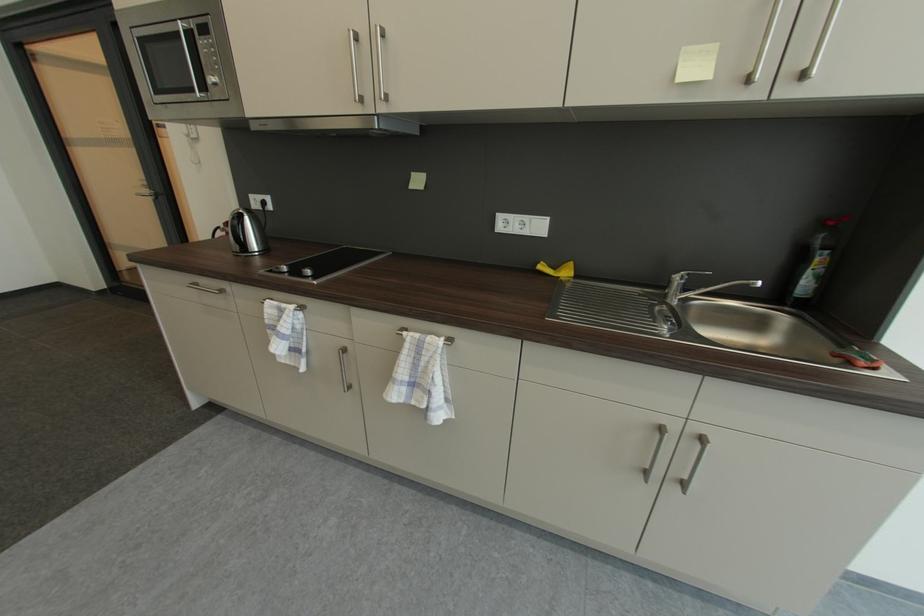
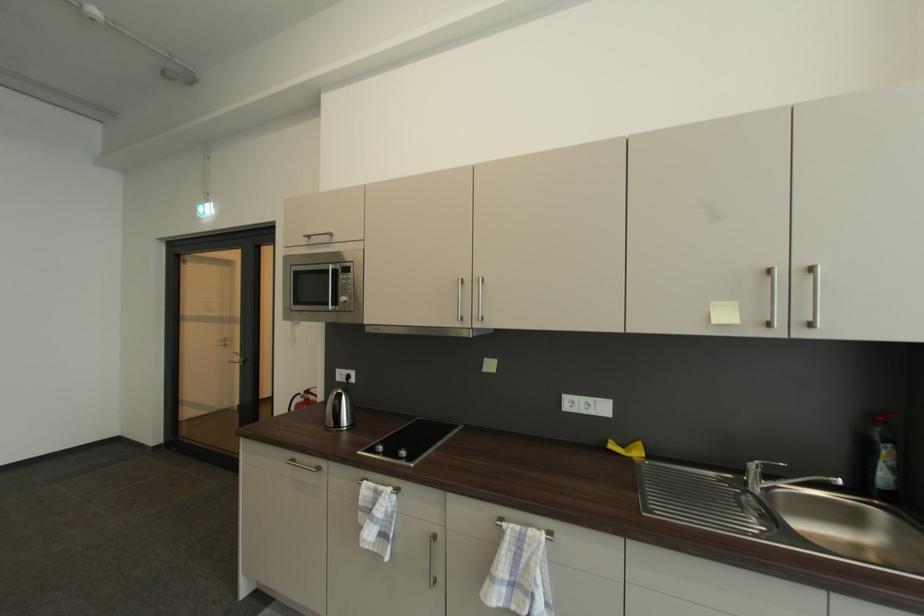
Where in the second image is the point corresponding to point 185,31 from the first image?

(334, 272)